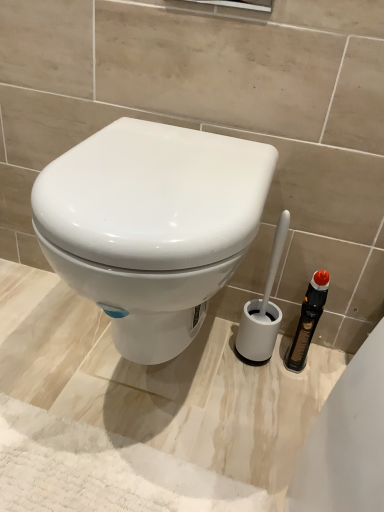
Describe the element at coordinates (151, 226) in the screenshot. This screenshot has width=384, height=512. I see `white glossy toilet at center` at that location.

Where is `white glossy toilet at center`? white glossy toilet at center is located at coordinates (151, 226).

Measure the distance between point (264, 325) and camera.

Point (264, 325) and camera are 39.21 inches apart from each other.

What do you see at coordinates (263, 308) in the screenshot?
I see `white plastic toilet brush at right` at bounding box center [263, 308].

Identify the location of white plastic toilet brush at right. (263, 308).

Where is `white glossy toilet at center`? This screenshot has height=512, width=384. white glossy toilet at center is located at coordinates (151, 226).

Visually, is white plastic toilet brush at right positioned to the left or to the right of white glossy toilet at center?

From the image, it's evident that white plastic toilet brush at right is to the right of white glossy toilet at center.

In the image, is white plastic toilet brush at right positioned in front of or behind white glossy toilet at center?

white plastic toilet brush at right is positioned farther from the viewer than white glossy toilet at center.

Is point (255, 358) closer or farther from the camera than point (222, 175)?

Clearly, point (255, 358) is more distant from the camera than point (222, 175).

From the image's perspective, which is above, white plastic toilet brush at right or white glossy toilet at center?

white glossy toilet at center, from the image's perspective.

From a real-world perspective, does white plastic toilet brush at right sit lower than white glossy toilet at center?

Yes.

Considering the sizes of objects white plastic toilet brush at right and white glossy toilet at center in the image provided, who is thinner, white plastic toilet brush at right or white glossy toilet at center?

With smaller width is white plastic toilet brush at right.

Considering the relative sizes of white plastic toilet brush at right and white glossy toilet at center in the image provided, is white plastic toilet brush at right shorter than white glossy toilet at center?

Yes.

Looking at the image, does white plastic toilet brush at right seem bigger or smaller compared to white glossy toilet at center?

Clearly, white plastic toilet brush at right is smaller in size than white glossy toilet at center.

Would you say white glossy toilet at center is part of white plastic toilet brush at right's contents?

Definitely not — white glossy toilet at center is not inside white plastic toilet brush at right.

Is white plastic toilet brush at right not near white glossy toilet at center?

They are positioned close to each other.

Is white plastic toilet brush at right positioned with its back to white glossy toilet at center?

No, white plastic toilet brush at right's orientation is not away from white glossy toilet at center.

I want to click on toilet above the white plastic toilet brush at right (from a real-world perspective), so click(x=151, y=226).

Can you confirm if white glossy toilet at center is positioned to the right of white plastic toilet brush at right?

No, white glossy toilet at center is not to the right of white plastic toilet brush at right.

Considering the relative positions of white glossy toilet at center and white plastic toilet brush at right in the image provided, is white glossy toilet at center in front of white plastic toilet brush at right?

Yes, the depth of white glossy toilet at center is less than that of white plastic toilet brush at right.

Is point (140, 311) closer to viewer compared to point (249, 325)?

Yes, it is.

From the image's perspective, is white glossy toilet at center under white plastic toilet brush at right?

Incorrect, from the image's perspective, white glossy toilet at center is higher than white plastic toilet brush at right.

From a real-world perspective, is white glossy toilet at center located beneath white plastic toilet brush at right?

No.

Looking at this image, can you confirm if white glossy toilet at center is thinner than white plastic toilet brush at right?

No, white glossy toilet at center is not thinner than white plastic toilet brush at right.

Is white glossy toilet at center shorter than white plastic toilet brush at right?

No, white glossy toilet at center is not shorter than white plastic toilet brush at right.

Who is smaller, white glossy toilet at center or white plastic toilet brush at right?

With smaller size is white plastic toilet brush at right.

Consider the image. Choose the correct answer: Is white glossy toilet at center inside white plastic toilet brush at right or outside it?

The correct answer is: outside.

Is white glossy toilet at center far away from white plastic toilet brush at right?

No, white glossy toilet at center is in close proximity to white plastic toilet brush at right.

Is white glossy toilet at center facing away from white plastic toilet brush at right?

No, white plastic toilet brush at right is not at the back of white glossy toilet at center.

How different are the orientations of white glossy toilet at center and white plastic toilet brush at right in degrees?

The angle between the facing direction of white glossy toilet at center and the facing direction of white plastic toilet brush at right is 0.000744 degrees.

Where is `toilet lying above the white plastic toilet brush at right (from the image's perspective)`? This screenshot has height=512, width=384. toilet lying above the white plastic toilet brush at right (from the image's perspective) is located at coordinates click(151, 226).

Locate an element on the screen. toilet above the white plastic toilet brush at right (from a real-world perspective) is located at coordinates (151, 226).

The image size is (384, 512). I want to click on toilet above the white plastic toilet brush at right (from the image's perspective), so click(x=151, y=226).